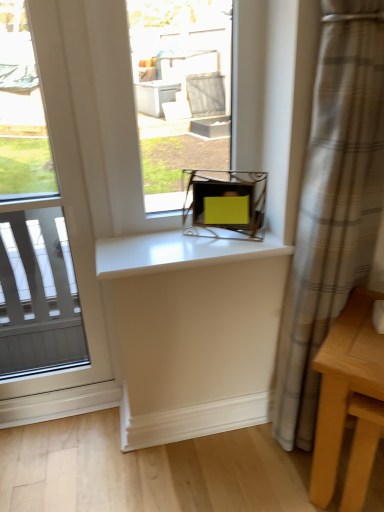
Where is `vacant space situated above white glossy counter top at center (from a real-world perspective)`? This screenshot has width=384, height=512. vacant space situated above white glossy counter top at center (from a real-world perspective) is located at coordinates (191, 237).